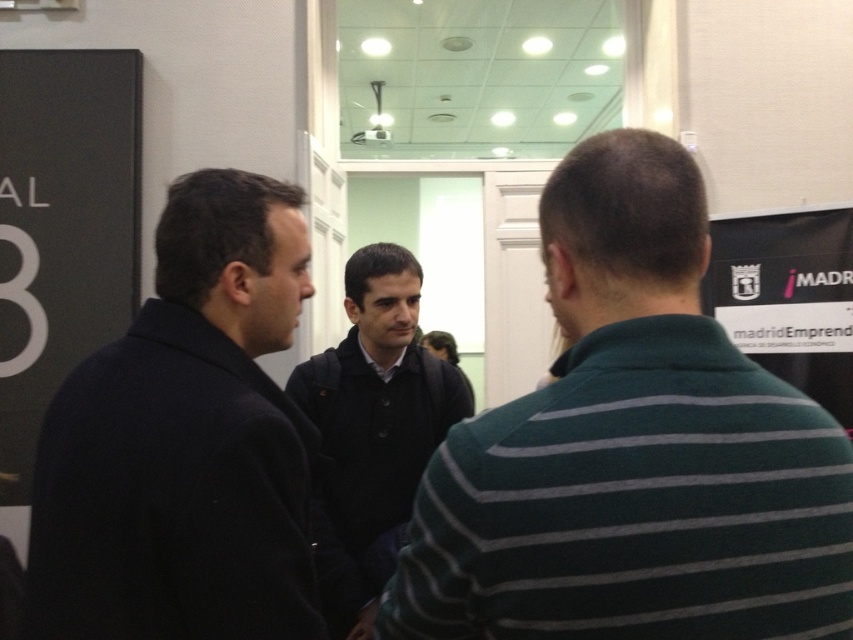
Which is more to the left, dark green striped polo shirt at center or dark blue wool coat at left?

dark blue wool coat at left

Does point (439, 444) lie behind point (30, 570)?

Yes.

Describe the element at coordinates (631, 451) in the screenshot. This screenshot has height=640, width=853. I see `dark green striped polo shirt at center` at that location.

Image resolution: width=853 pixels, height=640 pixels. Find the location of `dark green striped polo shirt at center`. dark green striped polo shirt at center is located at coordinates (631, 451).

Can you confirm if dark green striped polo shirt at center is positioned to the left of dark blue jacket at center?

Incorrect, dark green striped polo shirt at center is not on the left side of dark blue jacket at center.

Which is behind, point (706, 236) or point (338, 355)?

Positioned behind is point (338, 355).

Find the location of a particular element. dark green striped polo shirt at center is located at coordinates (631, 451).

Is dark blue wool coat at left further to the viewer compared to dark blue jacket at center?

No, it is not.

Looking at this image, can you confirm if dark blue wool coat at left is thinner than dark blue jacket at center?

Yes.

This screenshot has width=853, height=640. What do you see at coordinates (184, 442) in the screenshot?
I see `dark blue wool coat at left` at bounding box center [184, 442].

Where is `dark blue wool coat at left`? This screenshot has width=853, height=640. dark blue wool coat at left is located at coordinates (184, 442).